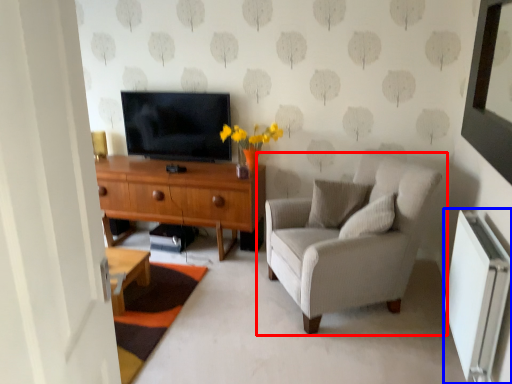
Question: Which of the following is the closest to the observer, chair (highlighted by a red box) or radiator (highlighted by a blue box)?

Choices:
 (A) chair
 (B) radiator

Answer: (B)